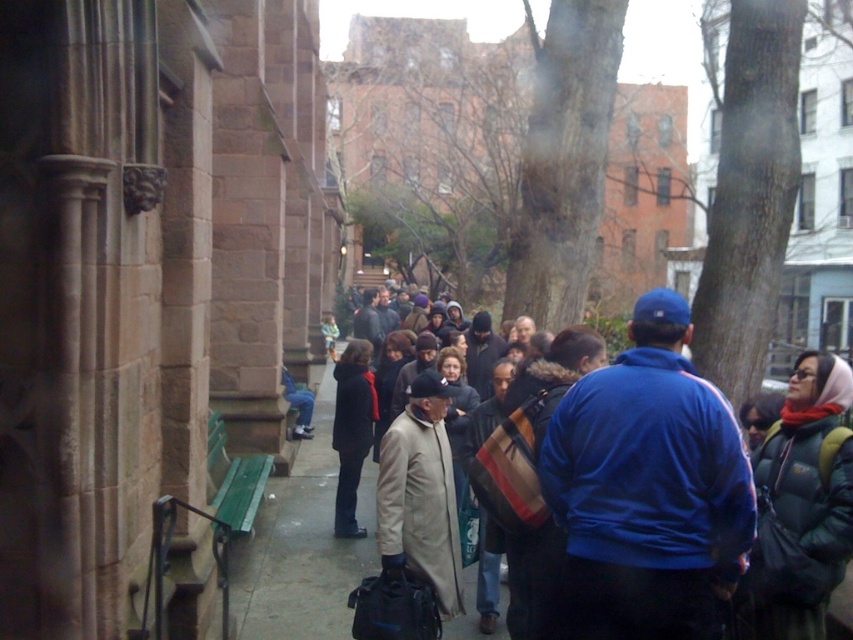
Question: Based on their relative distances, which object is farther from the dark blue jacket at center?

Choices:
 (A) light gray concrete sidewalk at center
 (B) dark gray wool coat at center

Answer: (B)

Question: Which object appears closest to the camera in this image?

Choices:
 (A) dark blue jacket at center
 (B) light gray concrete sidewalk at center
 (C) dark gray wool coat at center

Answer: (A)

Question: Is light gray concrete sidewalk at center to the left of dark gray wool coat at center from the viewer's perspective?

Choices:
 (A) yes
 (B) no

Answer: (A)

Question: Does light gray concrete sidewalk at center have a greater width compared to dark gray wool coat at center?

Choices:
 (A) yes
 (B) no

Answer: (A)

Question: Which object is the farthest from the dark blue jacket at center?

Choices:
 (A) dark gray wool coat at center
 (B) light gray concrete sidewalk at center

Answer: (A)

Question: Is dark blue jacket at center further to camera compared to light gray concrete sidewalk at center?

Choices:
 (A) yes
 (B) no

Answer: (B)